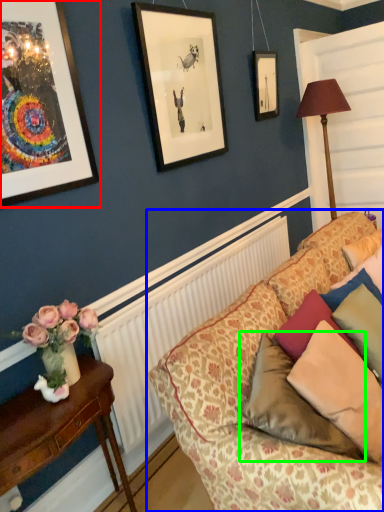
Question: Which object is the closest to the picture frame (highlighted by a red box)? Choose among these: studio couch (highlighted by a blue box) or pillow (highlighted by a green box).

Choices:
 (A) studio couch
 (B) pillow

Answer: (A)